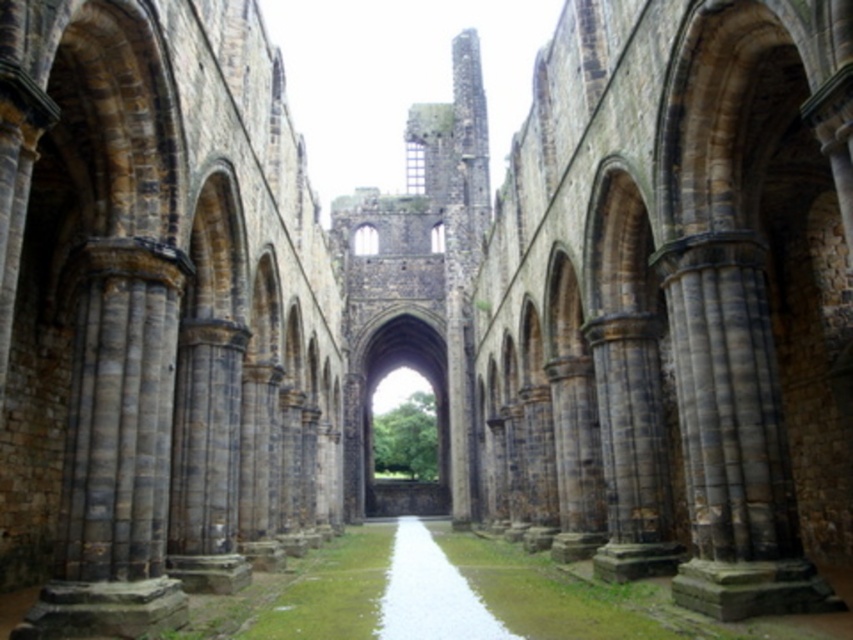
You are standing at the entrance of the grand stone structure and want to walk straight towards the stone archway at center. Based on the layout described, will you encounter any of the tall, arched columns made of weathered stone along your path?

The stone archway at center is located at point (370, 412), which suggests it is positioned along the central aisle. Since the columns are evenly spaced along both sides of the central aisle, your straight path towards the stone archway at center would not encounter any columns, as they are placed on the sides, not the center path.

You are an architect visiting the cathedral ruins. You need to determine if a 3D printed model of the stone archway at center will fit on the white stone path at center. The model is exactly the same size as the real archway. Will it fit?

The stone archway at center is bigger than the white stone path at center, so the 3D printed model of the stone archway at center will not fit on the white stone path at center because it is larger than the path.